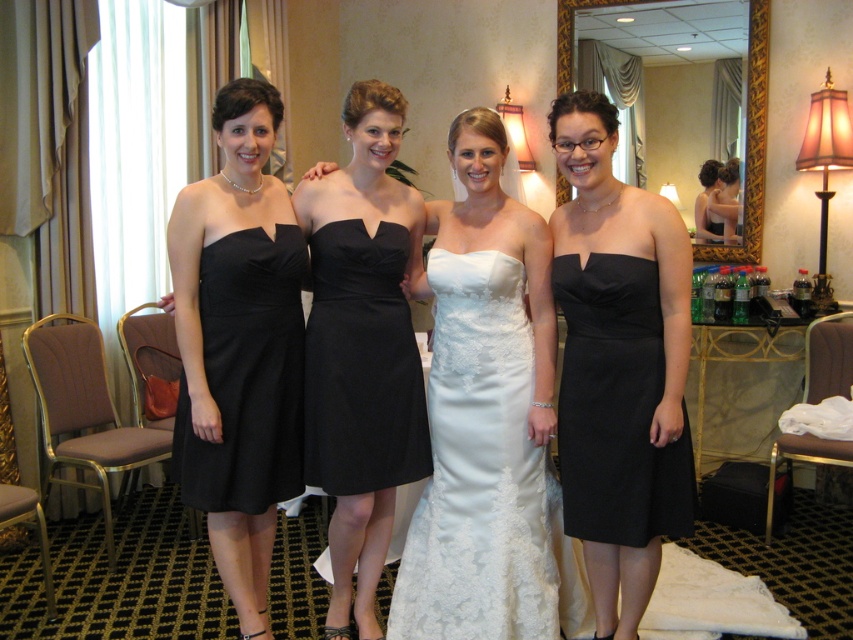
Question: Which is nearer to the matte black dress at center?

Choices:
 (A) black satin dress at right
 (B) matte black dress at left
 (C) white satin dress at center
 (D) black satin dress at left

Answer: (D)

Question: Does matte black dress at center appear under black satin dress at right?

Choices:
 (A) yes
 (B) no

Answer: (B)

Question: Which of these objects is positioned farthest from the matte black dress at left?

Choices:
 (A) black satin dress at center
 (B) black satin dress at left
 (C) black satin dress at right

Answer: (C)

Question: Does white satin dress at center come behind matte black dress at center?

Choices:
 (A) no
 (B) yes

Answer: (A)

Question: Is matte black dress at left below matte black dress at center?

Choices:
 (A) yes
 (B) no

Answer: (B)

Question: Which point is closer to the camera taking this photo?

Choices:
 (A) (271, 380)
 (B) (601, 500)
 (C) (380, 326)

Answer: (B)